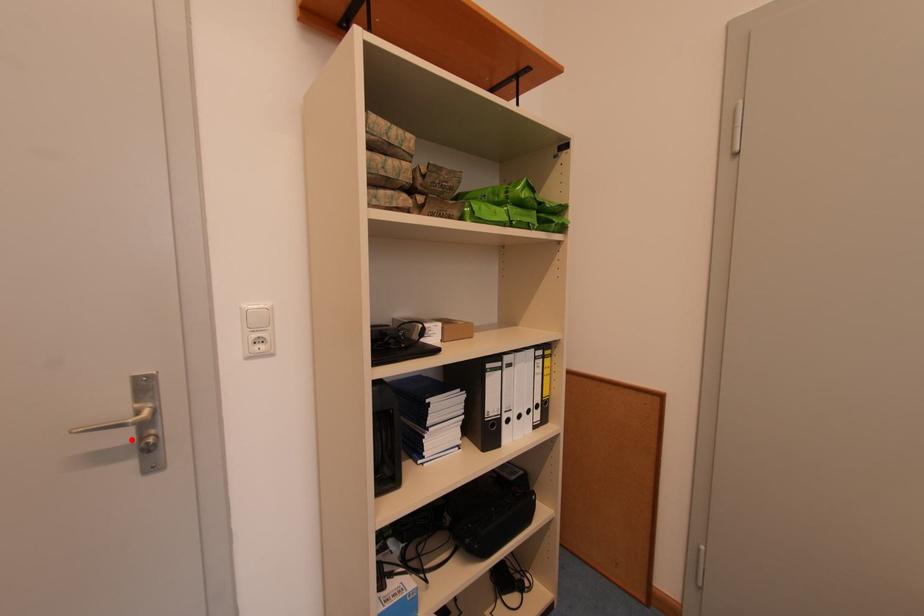
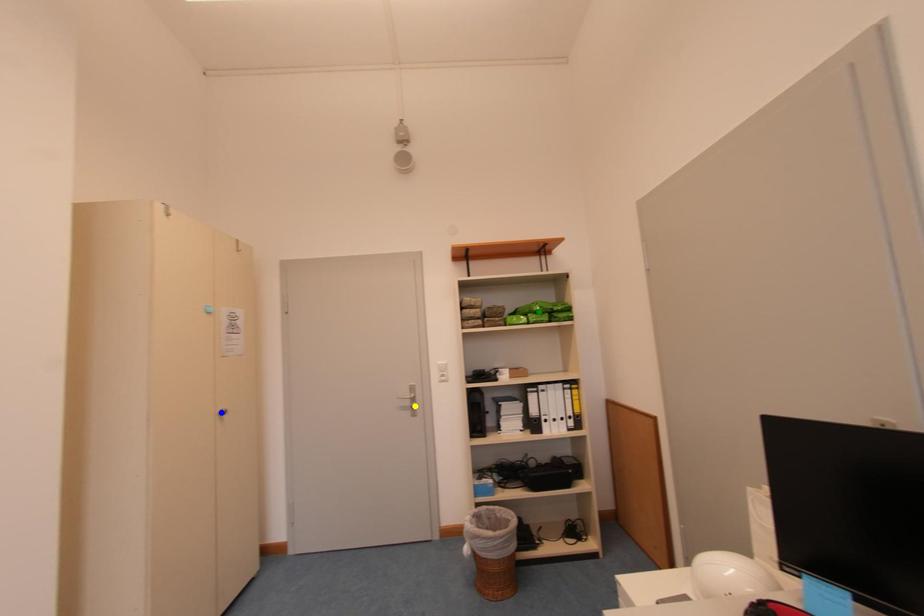
Question: I am providing you with two images of the same scene from different viewpoints. A red point is marked on the first image. You are given multiple points on the second image. Which mark in image 2 goes with the point in image 1?

Choices:
 (A) green point
 (B) blue point
 (C) yellow point

Answer: (C)